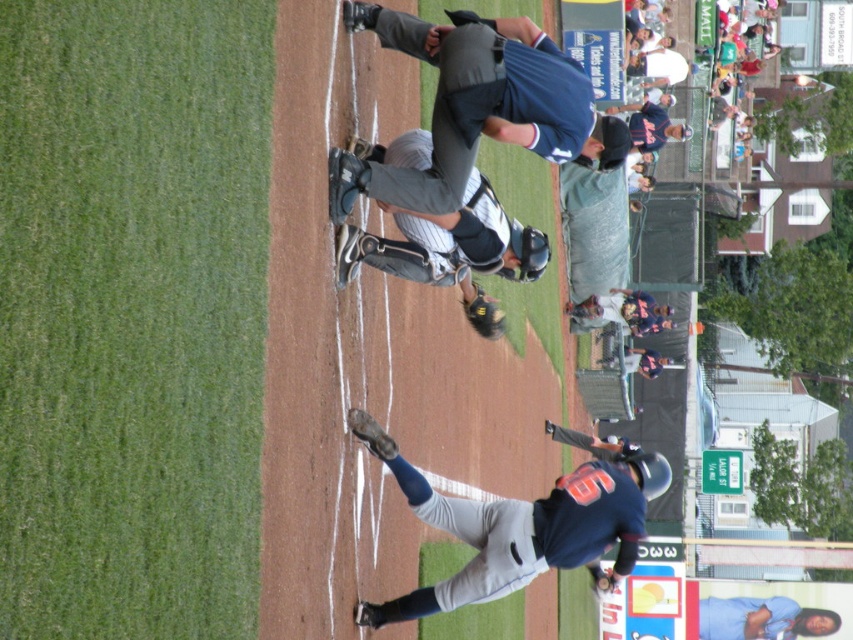
You are a baseball player standing at home plate. You see the gray fabric catcher at center and the dark brown leather glove at lower center. Which object is closer to you?

The gray fabric catcher at center is closer to you because it is in front of the dark brown leather glove at lower center.

You are a player on the baseball field and you need to locate the blue fabric baseball glove at center. Based on the coordinates provided, where should you look on the field?

You should look at the point with coordinates 0.163 on the x axis and 0.553 on the y axis to find the blue fabric baseball glove at center.

You are a photographer standing at the center of the baseball field. You want to take a photo of both point (524, 241) and point (375, 428) in the image. Which point is closer to your camera?

Point (375, 428) is closer to the camera because it is positioned behind point (524, 241), which is further away from the camera.